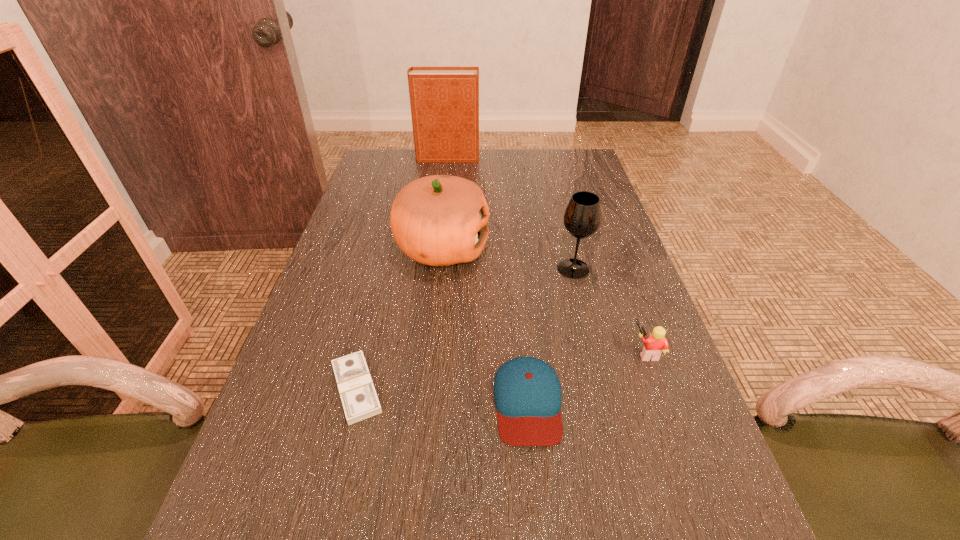
Image resolution: width=960 pixels, height=540 pixels. What are the coordinates of `the farthest object` in the screenshot? It's located at (444, 101).

You are a GUI agent. You are given a task and a screenshot of the screen. Output one action in this format:
    pyautogui.click(x=<x>, y=<y>)
    Task: Click on the hardback book
    
    Given the screenshot: What is the action you would take?
    pyautogui.click(x=444, y=101)

Identify the location of pumpkin. The image size is (960, 540). (439, 220).

In order to click on the fifth object from left to right in this screenshot , I will do point(582,217).

At what (x,y) coordinates should I click in order to perform the action: click on Lego. Please return your answer as a coordinate pair (x, y). Looking at the image, I should click on (656, 342).

Identify the location of the fourth tallest object. Image resolution: width=960 pixels, height=540 pixels. (656, 342).

Locate an element on the screen. The width and height of the screenshot is (960, 540). the fifth tallest object is located at coordinates (527, 392).

The height and width of the screenshot is (540, 960). Find the location of `baseball cap`. baseball cap is located at coordinates (527, 392).

Locate an element on the screen. This screenshot has height=540, width=960. the shortest object is located at coordinates (358, 395).

The height and width of the screenshot is (540, 960). In order to click on free space located 0.170m on the open cover of the hardback book in this screenshot , I will do pos(528,158).